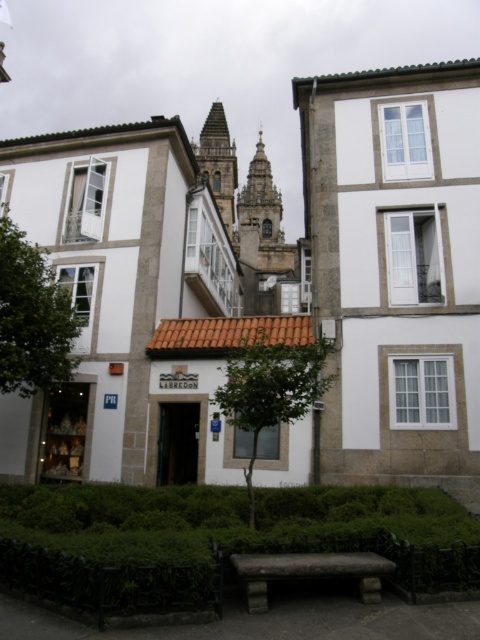
Question: Does green leafy tree at left have a lesser width compared to gray stone bell tower at center?

Choices:
 (A) yes
 (B) no

Answer: (A)

Question: Which of the following is the closest to the observer?

Choices:
 (A) stone textured bench at center
 (B) green leafy tree at center
 (C) brown stone bell tower at upper center
 (D) gray stone bell tower at center

Answer: (A)

Question: Does green leafy tree at left appear under brown stone bell tower at upper center?

Choices:
 (A) no
 (B) yes

Answer: (B)

Question: Estimate the real-world distances between objects in this image. Which object is farther from the green leafy tree at center?

Choices:
 (A) gray stone bell tower at center
 (B) brown stone bell tower at upper center

Answer: (B)

Question: Which of the following is the farthest from the observer?

Choices:
 (A) pyautogui.click(x=268, y=163)
 (B) pyautogui.click(x=215, y=157)

Answer: (A)

Question: From the image, what is the correct spatial relationship of green leafy tree at left in relation to green leafy tree at center?

Choices:
 (A) above
 (B) below

Answer: (A)